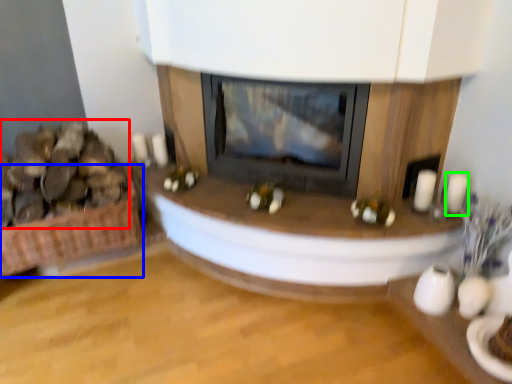
Question: Which object is the farthest from food (highlighted by a red box)? Choose among these: basket (highlighted by a blue box) or candle (highlighted by a green box).

Choices:
 (A) basket
 (B) candle

Answer: (B)